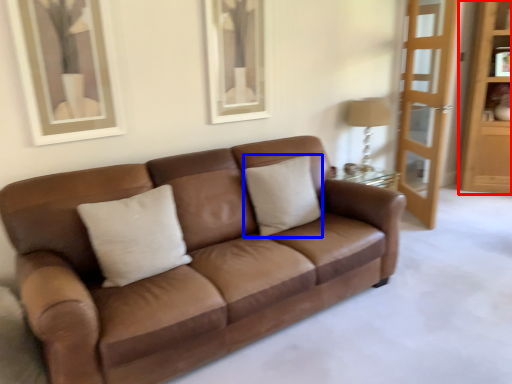
Question: Which object appears closest to the camera in this image, dresser (highlighted by a red box) or pillow (highlighted by a blue box)?

Choices:
 (A) dresser
 (B) pillow

Answer: (B)